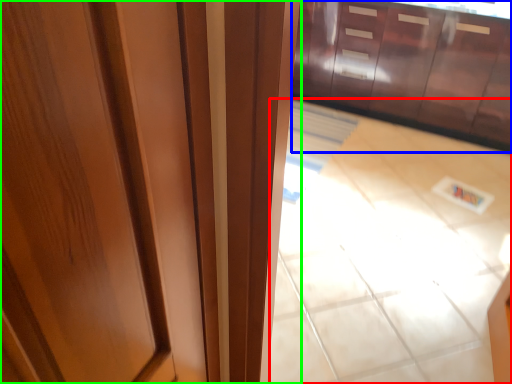
Question: Which is nearer to the tile (highlighted by a red box)? cabinetry (highlighted by a blue box) or door (highlighted by a green box).

Choices:
 (A) cabinetry
 (B) door

Answer: (A)